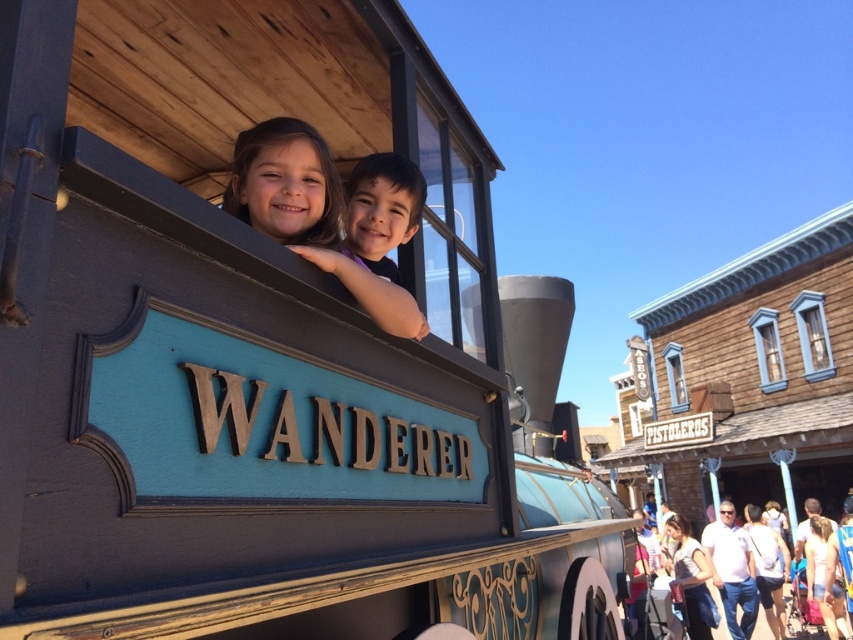
In order to click on matte black hair at upper center in this screenshot , I will do `click(309, 214)`.

Does matte black hair at upper center have a lesser height compared to white matte coach at lower right?

Correct, matte black hair at upper center is not as tall as white matte coach at lower right.

Between point (294, 124) and point (729, 600), which one is positioned behind?

The point (729, 600) is more distant.

The height and width of the screenshot is (640, 853). In order to click on matte black hair at upper center in this screenshot , I will do `click(309, 214)`.